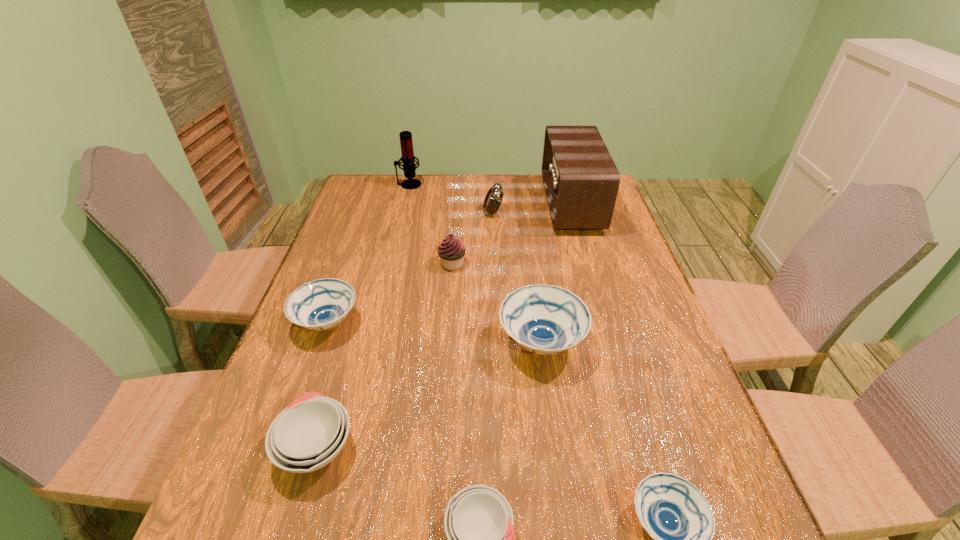
At what (x,y) coordinates should I click in order to perform the action: click on free space located on the front-facing side of the radio receiver. Please return your answer as a coordinate pair (x, y). The image size is (960, 540). Looking at the image, I should click on (449, 204).

Find the location of a particular element. free spot located 0.340m on the front-facing side of the radio receiver is located at coordinates (449, 204).

Image resolution: width=960 pixels, height=540 pixels. What are the coordinates of `vacant region located 0.300m on the front-facing side of the radio receiver` in the screenshot? It's located at (461, 204).

Where is `free spot located 0.320m on the right of the microphone`? free spot located 0.320m on the right of the microphone is located at coordinates (508, 185).

Locate an element on the screen. blank space located 0.390m on the face of the alarm clock is located at coordinates (368, 212).

In order to click on vacant area located 0.100m on the face of the alarm clock in this screenshot , I will do `click(453, 212)`.

The height and width of the screenshot is (540, 960). Identify the location of free location located on the face of the alarm clock. (368, 212).

Locate an element on the screen. The height and width of the screenshot is (540, 960). vacant space located on the left of the sixth nearest object is located at coordinates tap(408, 264).

The width and height of the screenshot is (960, 540). What are the coordinates of `free space located 0.330m on the left of the tallest soup bowl` in the screenshot? It's located at (361, 342).

Identify the location of vacant space situated on the back of the second smallest blue soup bowl. Image resolution: width=960 pixels, height=540 pixels. (341, 285).